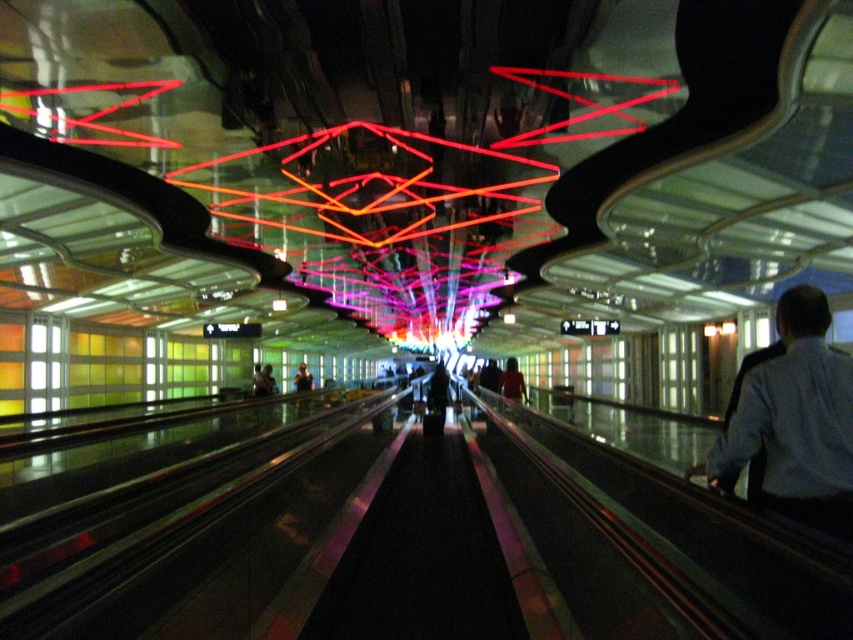
Is light blue shirt at right further to the viewer compared to matte black jacket at center?

That is False.

Is light blue shirt at right below matte black jacket at center?

Incorrect, light blue shirt at right is not positioned below matte black jacket at center.

You are a GUI agent. You are given a task and a screenshot of the screen. Output one action in this format:
    pyautogui.click(x=<x>, y=<y>)
    Task: Click on the light blue shirt at right
    
    Given the screenshot: What is the action you would take?
    point(793,422)